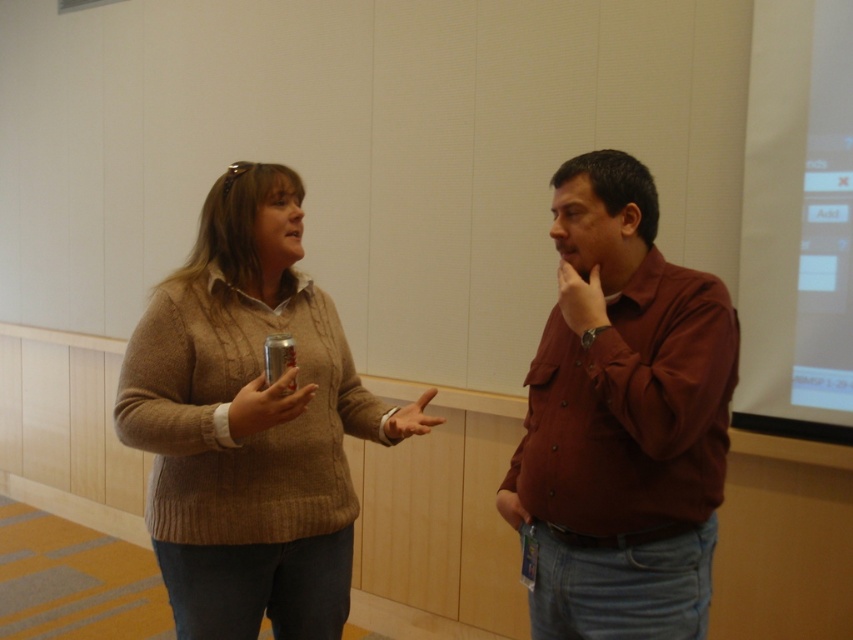
Does knitted sweater at center have a greater height compared to matte brown shirt at center?

Correct, knitted sweater at center is much taller as matte brown shirt at center.

Who is lower down, knitted sweater at center or matte brown shirt at center?

knitted sweater at center is lower down.

Is point (177, 604) more distant than point (724, 348)?

Yes, point (177, 604) is behind point (724, 348).

You are a GUI agent. You are given a task and a screenshot of the screen. Output one action in this format:
    pyautogui.click(x=<x>, y=<y>)
    Task: Click on the knitted sweater at center
    The image size is (853, 640).
    Given the screenshot: What is the action you would take?
    pyautogui.click(x=250, y=422)

Between knitted sweater at center and metallic can at center, which one has less height?

With less height is metallic can at center.

I want to click on knitted sweater at center, so click(x=250, y=422).

This screenshot has width=853, height=640. In order to click on knitted sweater at center in this screenshot , I will do `click(250, 422)`.

Is point (587, 595) positioned behind point (282, 353)?

No, (587, 595) is in front of (282, 353).

The image size is (853, 640). In order to click on matte brown shirt at center in this screenshot , I will do `click(622, 419)`.